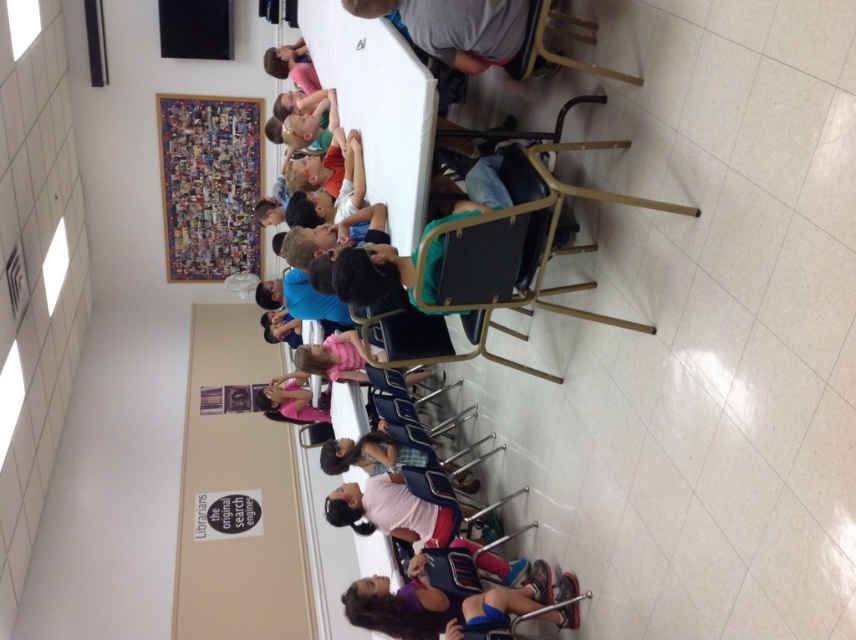
Question: Does matte purple shirt at lower center appear over pink fabric dress at center?

Choices:
 (A) no
 (B) yes

Answer: (A)

Question: Which of the following is the closest to the observer?

Choices:
 (A) matte purple shirt at lower center
 (B) pink fabric dress at center

Answer: (A)

Question: Can you confirm if matte purple shirt at lower center is positioned to the left of pink fabric dress at center?

Choices:
 (A) yes
 (B) no

Answer: (B)

Question: In this image, where is matte purple shirt at lower center located relative to pink fabric dress at center?

Choices:
 (A) right
 (B) left

Answer: (A)